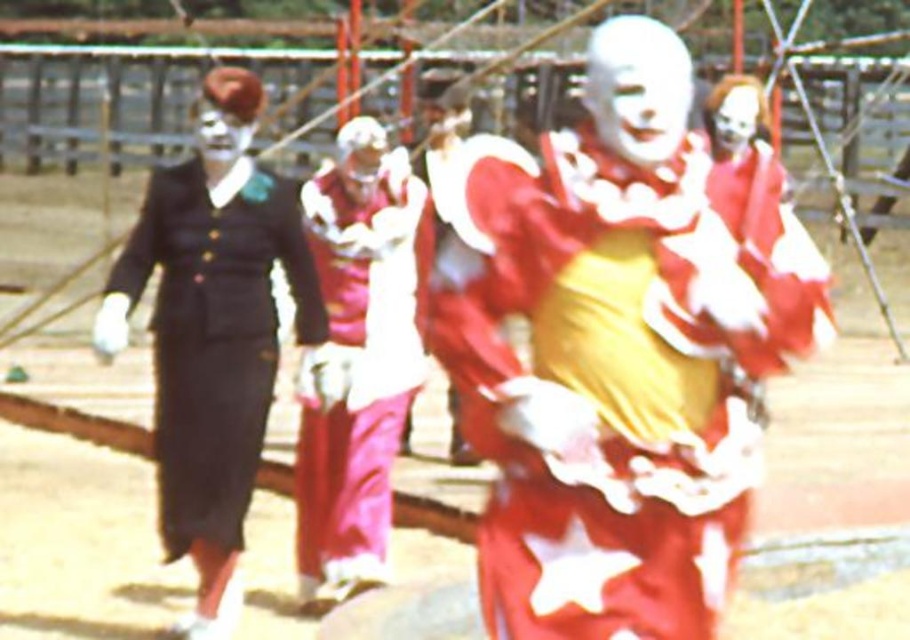
You are a photographer trying to capture the shiny red fabric clown at center and the shiny red clown costume at center. Which one is located higher in the image?

The shiny red fabric clown at center is positioned over the shiny red clown costume at center, so it is higher in the image.

You are a photographer trying to capture the best shot of the performance. You notice two points marked in the scene. The first point is at coordinates point (669, 516) and the second at point (401, 353). Which point is closer to the camera based on their positions?

Point (669, 516) is in front of point (401, 353), so it is closer to the camera.